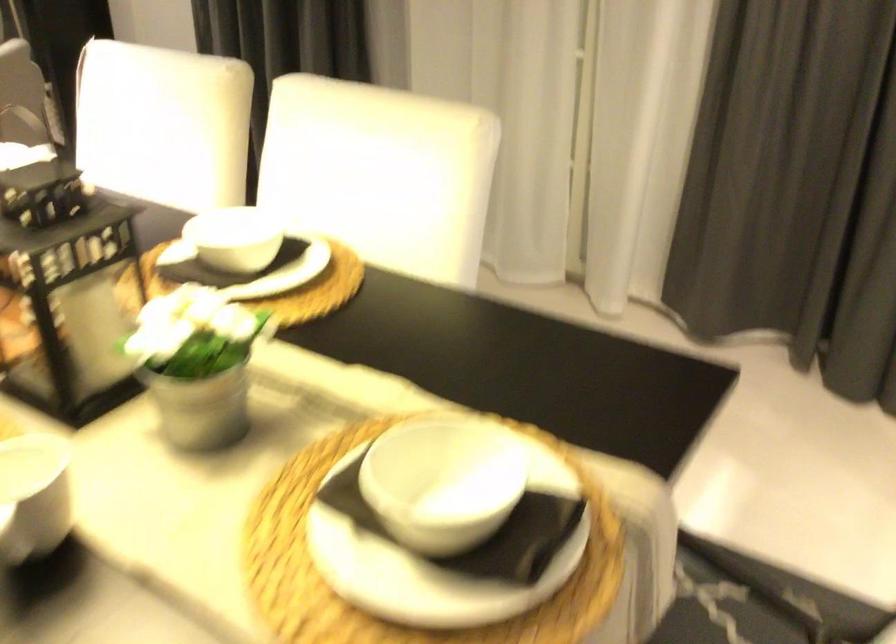
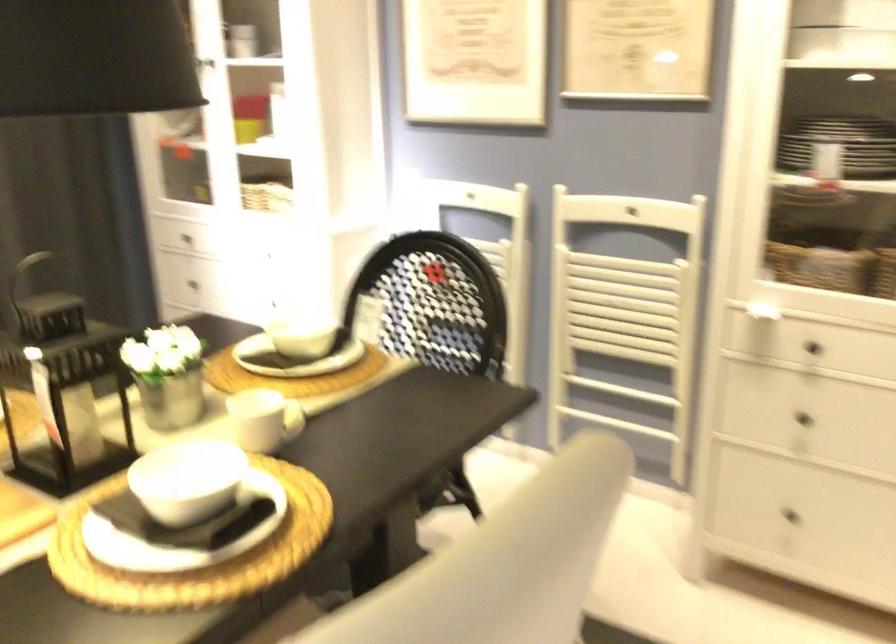
Locate, in the second image, the point that corresponds to [307,540] in the first image.

(298, 384)